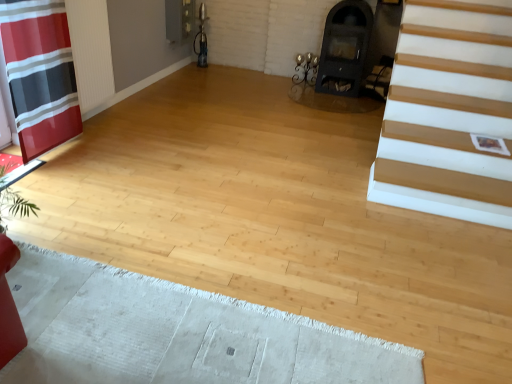
Question: Is matte black armchair at center positioned with its back to red striped fabric at left?

Choices:
 (A) yes
 (B) no

Answer: (B)

Question: Considering the relative sizes of matte black armchair at center and red striped fabric at left in the image provided, is matte black armchair at center taller than red striped fabric at left?

Choices:
 (A) no
 (B) yes

Answer: (A)

Question: Is matte black armchair at center completely or partially outside of red striped fabric at left?

Choices:
 (A) yes
 (B) no

Answer: (A)

Question: Is matte black armchair at center to the left of red striped fabric at left from the viewer's perspective?

Choices:
 (A) no
 (B) yes

Answer: (A)

Question: Does matte black armchair at center come behind red striped fabric at left?

Choices:
 (A) yes
 (B) no

Answer: (A)

Question: From a real-world perspective, does matte black armchair at center stand above red striped fabric at left?

Choices:
 (A) yes
 (B) no

Answer: (B)

Question: From the image's perspective, is red striped fabric at left under white textured rug at lower left?

Choices:
 (A) yes
 (B) no

Answer: (B)

Question: Does red striped fabric at left have a lesser width compared to white textured rug at lower left?

Choices:
 (A) no
 (B) yes

Answer: (B)

Question: From the image's perspective, is red striped fabric at left on top of white textured rug at lower left?

Choices:
 (A) no
 (B) yes

Answer: (B)

Question: Does red striped fabric at left have a smaller size compared to white textured rug at lower left?

Choices:
 (A) no
 (B) yes

Answer: (A)

Question: Does red striped fabric at left have a lesser height compared to white textured rug at lower left?

Choices:
 (A) yes
 (B) no

Answer: (B)

Question: Does red striped fabric at left touch white textured rug at lower left?

Choices:
 (A) yes
 (B) no

Answer: (B)

Question: Is white textured rug at lower left looking in the opposite direction of black matte fireplace at upper center?

Choices:
 (A) no
 (B) yes

Answer: (A)